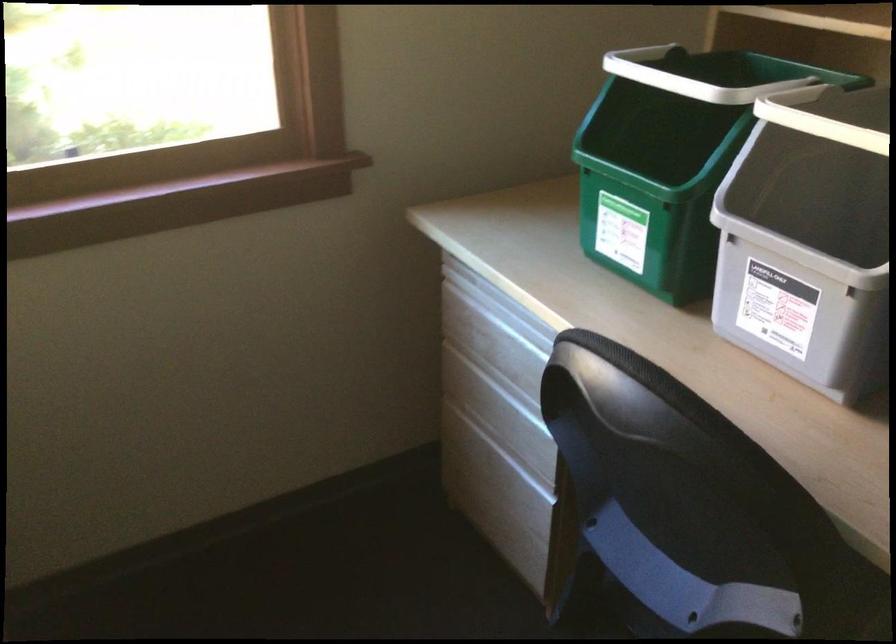
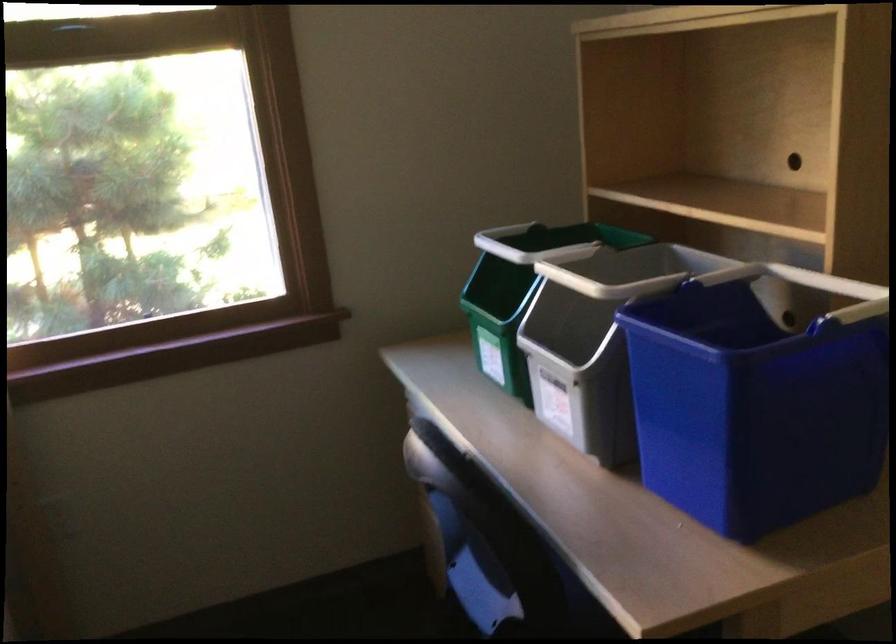
Question: How did the camera likely rotate?

Choices:
 (A) Left
 (B) Right
 (C) Up
 (D) Down

Answer: (C)